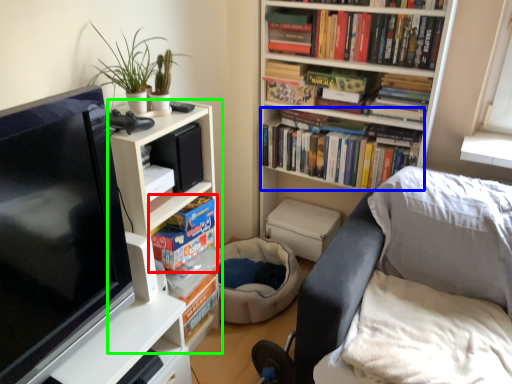
Question: Considering the real-world distances, which object is closest to book (highlighted by a red box)? book (highlighted by a blue box) or bookcase (highlighted by a green box).

Choices:
 (A) book
 (B) bookcase

Answer: (B)